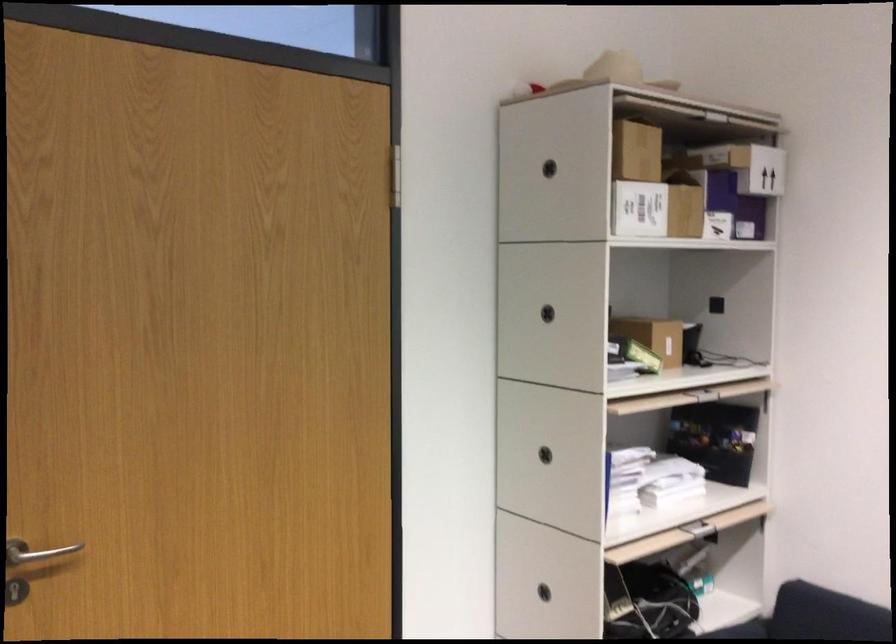
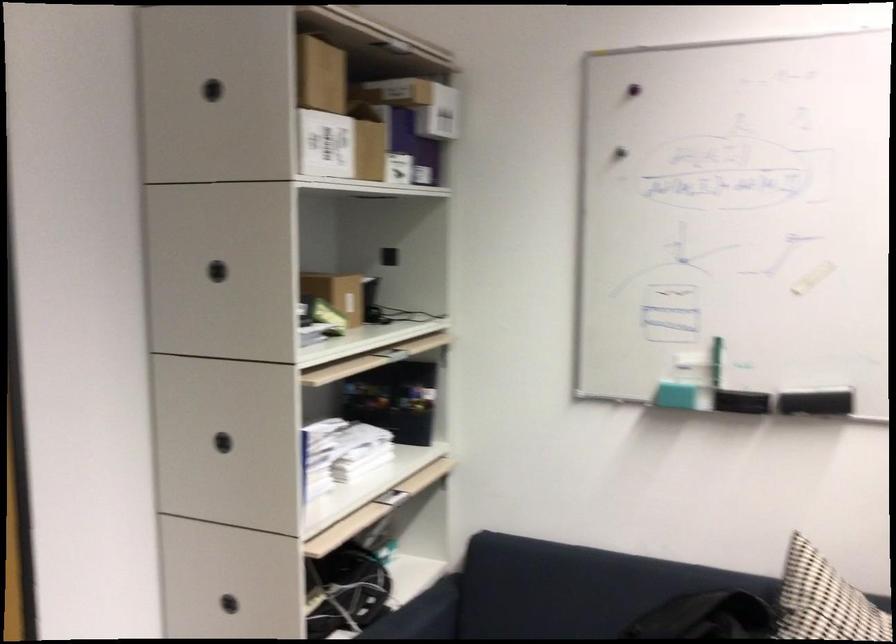
Question: The camera is either moving clockwise (left) or counter-clockwise (right) around the object. The first image is from the beginning of the video and the second image is from the end. Is the camera moving left or right when shooting the video?

Choices:
 (A) Left
 (B) Right

Answer: (A)